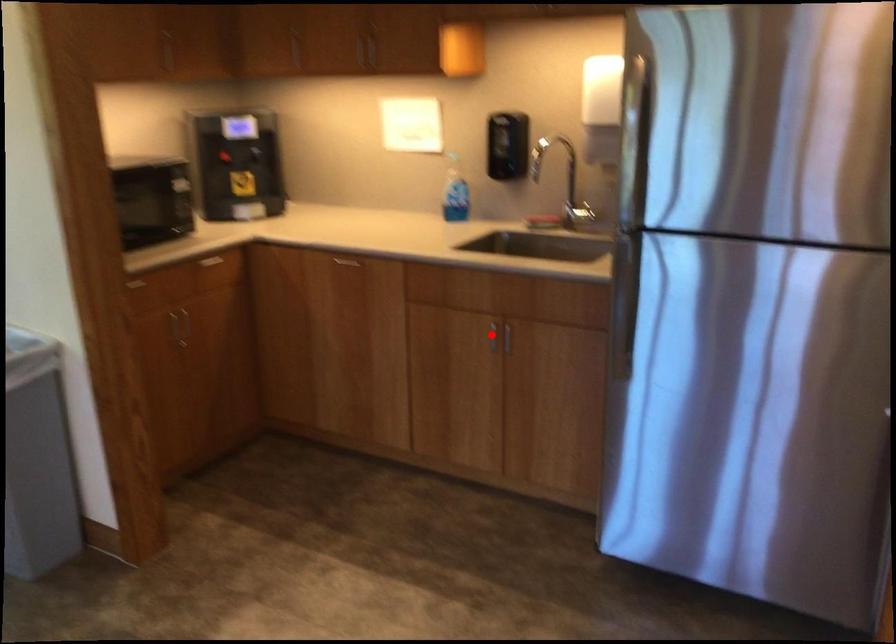
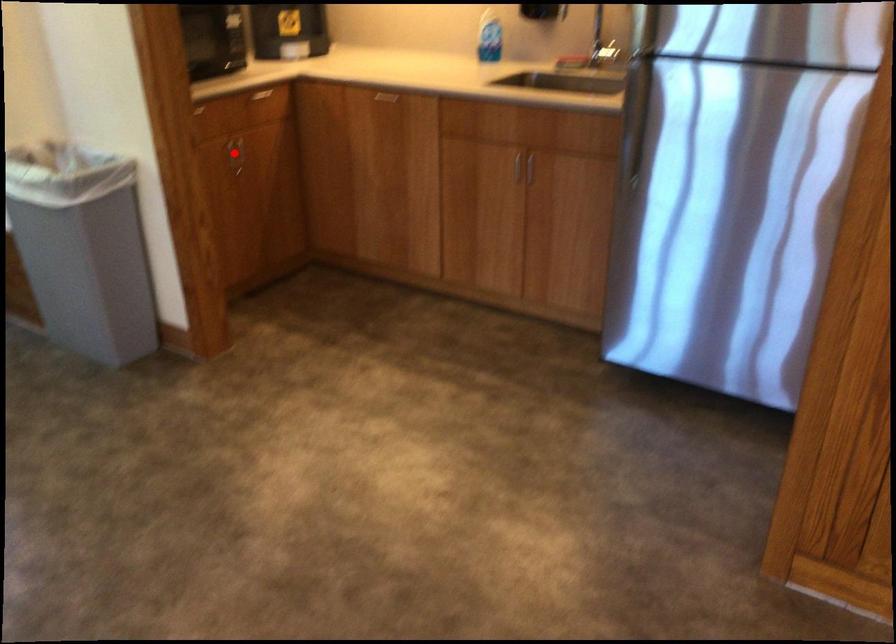
I am providing you with two images of the same scene from different viewpoints. A red point is marked on the first image and another point is marked on the second image. Does the point marked in image1 correspond to the same location as the one in image2?

No